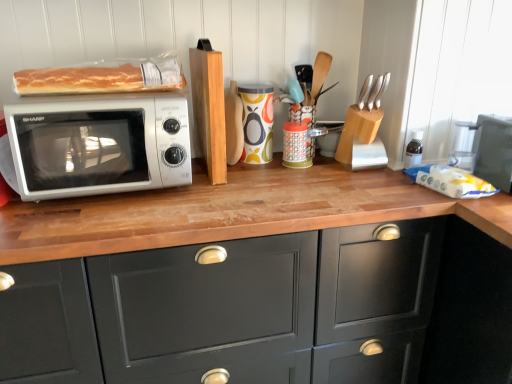
Find the location of `vacant space to the right of light brown wooden block at center`. vacant space to the right of light brown wooden block at center is located at coordinates (271, 176).